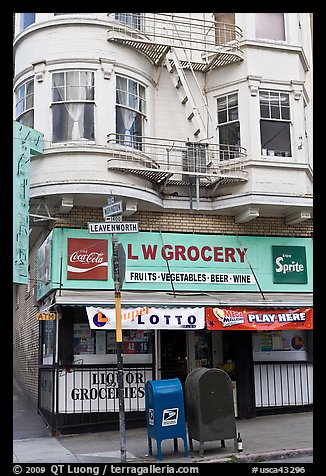
In order to click on doors in this screenshot , I will do `click(160, 353)`, `click(193, 349)`.